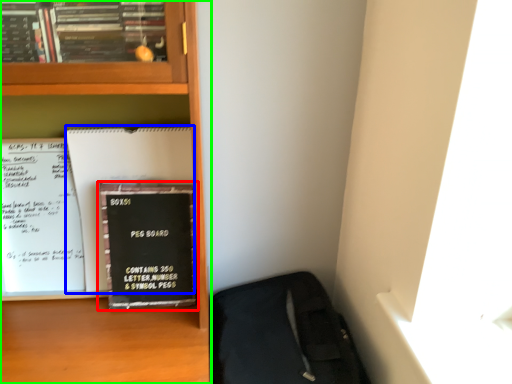
Question: Which is farther away from book (highlighted by a red box)? paperback book (highlighted by a blue box) or bookcase (highlighted by a green box)?

Choices:
 (A) paperback book
 (B) bookcase

Answer: (B)